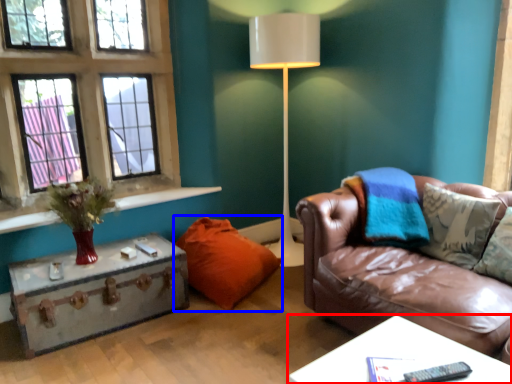
Question: Among these objects, which one is nearest to the camera, table (highlighted by a red box) or pillow (highlighted by a blue box)?

Choices:
 (A) table
 (B) pillow

Answer: (A)